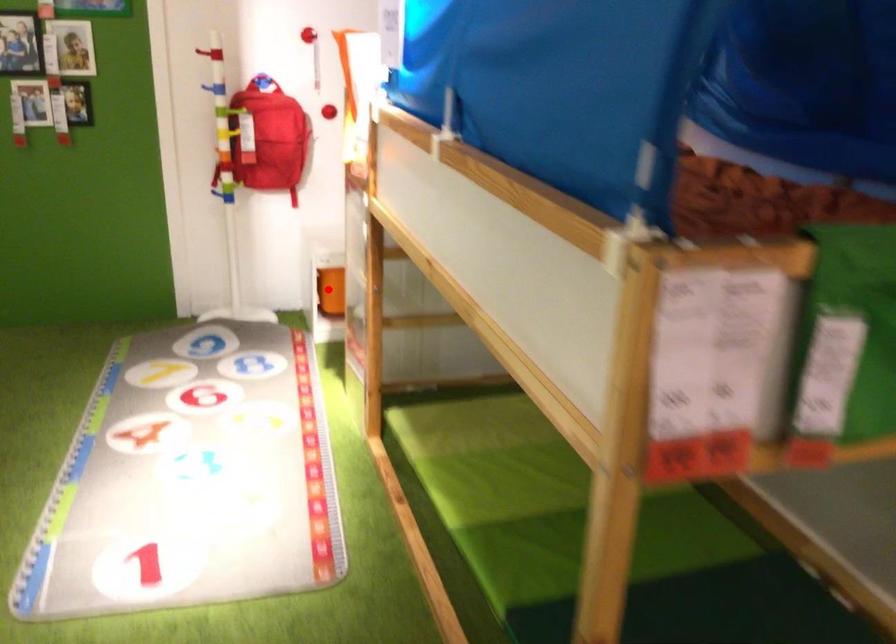
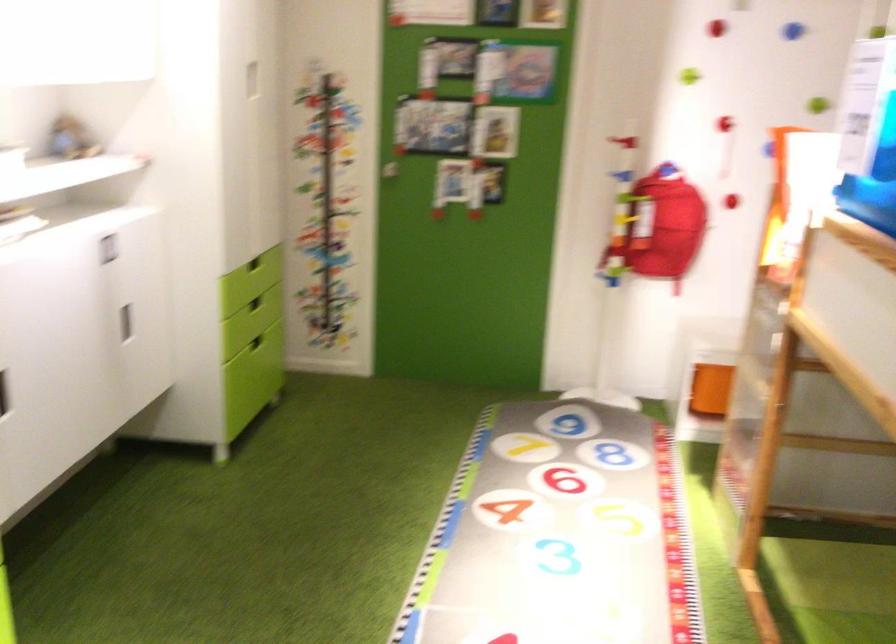
Question: I am providing you with two images of the same scene from different viewpoints. Image1 has a red point marked. In image2, the corresponding 3D location appears at what relative position? Reply with the corresponding letter.

Choices:
 (A) Closer
 (B) Farther

Answer: (A)